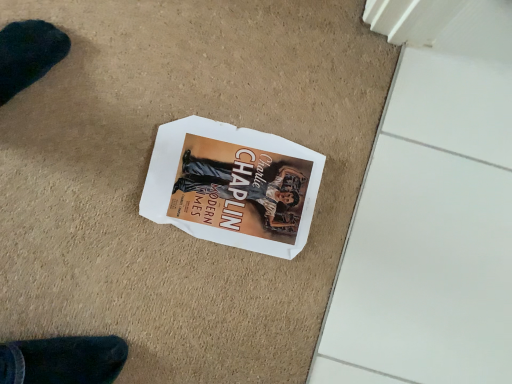
Identify the location of white paper at center. Image resolution: width=512 pixels, height=384 pixels. (232, 186).

The width and height of the screenshot is (512, 384). What do you see at coordinates (232, 186) in the screenshot?
I see `white paper at center` at bounding box center [232, 186].

Locate an element on the screen. white paper at center is located at coordinates (232, 186).